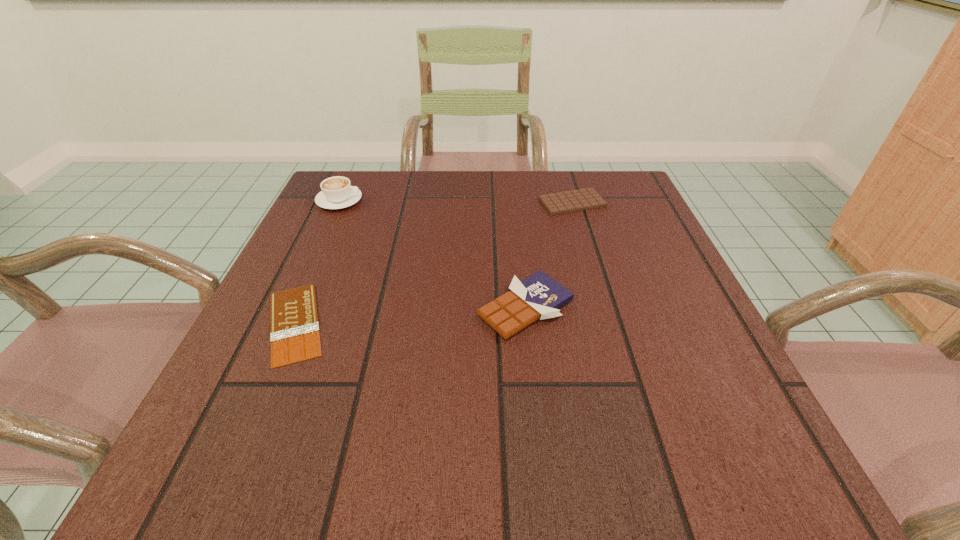
This screenshot has width=960, height=540. I want to click on vacant space that satisfies the following two spatial constraints: 1. on the side of the cappuccino with the handle; 2. on the back side of the tallest chocolate bar, so click(x=290, y=308).

You are a GUI agent. You are given a task and a screenshot of the screen. Output one action in this format:
    pyautogui.click(x=<x>, y=<y>)
    Task: Click on the vacant point that satisfies the following two spatial constraints: 1. on the side of the cappuccino with the handle; 2. on the left side of the leftmost chocolate bar
    This screenshot has height=540, width=960.
    Given the screenshot: What is the action you would take?
    pyautogui.click(x=283, y=323)

Where is `vacant space that satisfies the following two spatial constraints: 1. on the side of the third tallest object with the handle; 2. on the left side of the tallest object`? vacant space that satisfies the following two spatial constraints: 1. on the side of the third tallest object with the handle; 2. on the left side of the tallest object is located at coordinates [x=339, y=202].